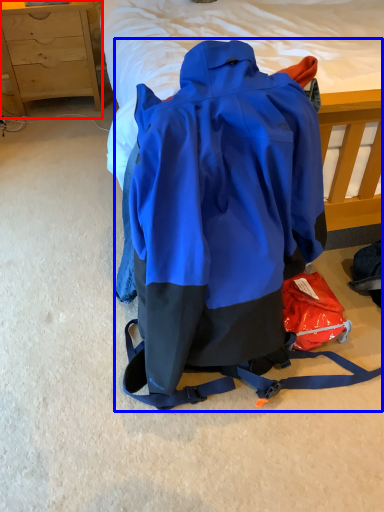
Question: Which object appears closest to the camera in this image, chest of drawers (highlighted by a red box) or backpack (highlighted by a blue box)?

Choices:
 (A) chest of drawers
 (B) backpack

Answer: (B)